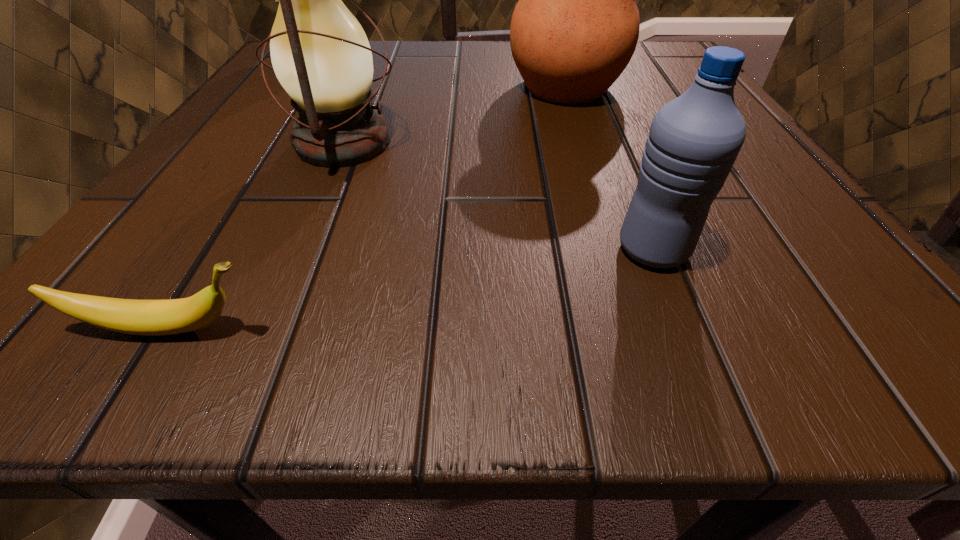
Where is `vacant space located at the stem of the shortest object`? The image size is (960, 540). vacant space located at the stem of the shortest object is located at coordinates (625, 328).

The image size is (960, 540). What are the coordinates of `wine bottle situated at the far edge` in the screenshot? It's located at pos(343,0).

The image size is (960, 540). What are the coordinates of `pottery that is at the far edge` in the screenshot? It's located at (575, 28).

The image size is (960, 540). Identify the location of object present at the near edge. (173, 316).

Where is `wine bottle at the left edge`? The image size is (960, 540). wine bottle at the left edge is located at coordinates (343, 0).

Identify the location of oil lamp that is at the left edge. (320, 54).

Locate an element on the screen. The image size is (960, 540). banana situated at the left edge is located at coordinates (173, 316).

In order to click on pottery that is at the right edge in this screenshot , I will do `click(575, 28)`.

Where is `water bottle that is positioned at the right edge`? water bottle that is positioned at the right edge is located at coordinates (694, 140).

Locate an element on the screen. object that is at the far left corner is located at coordinates (343, 0).